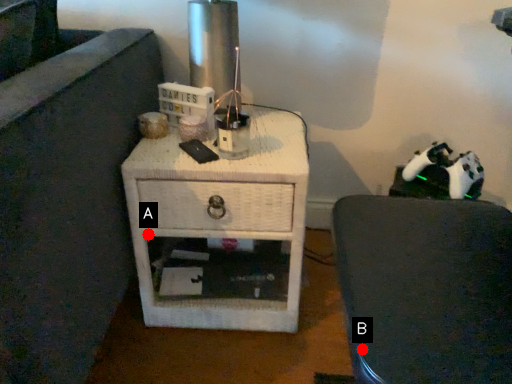
Question: Two points are circled on the image, labeled by A and B beside each circle. Among these points, which one is farthest from the camera?

Choices:
 (A) A is further
 (B) B is further

Answer: (A)